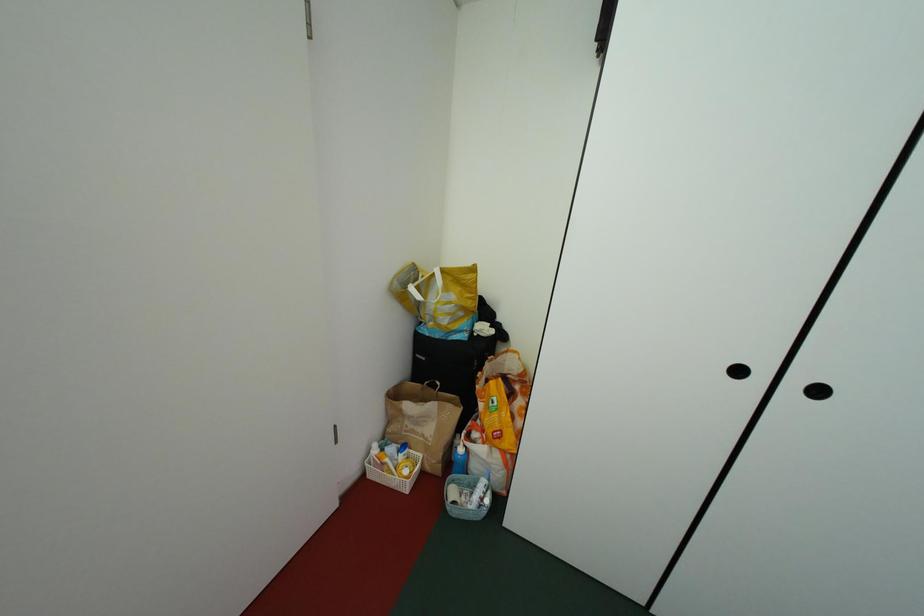
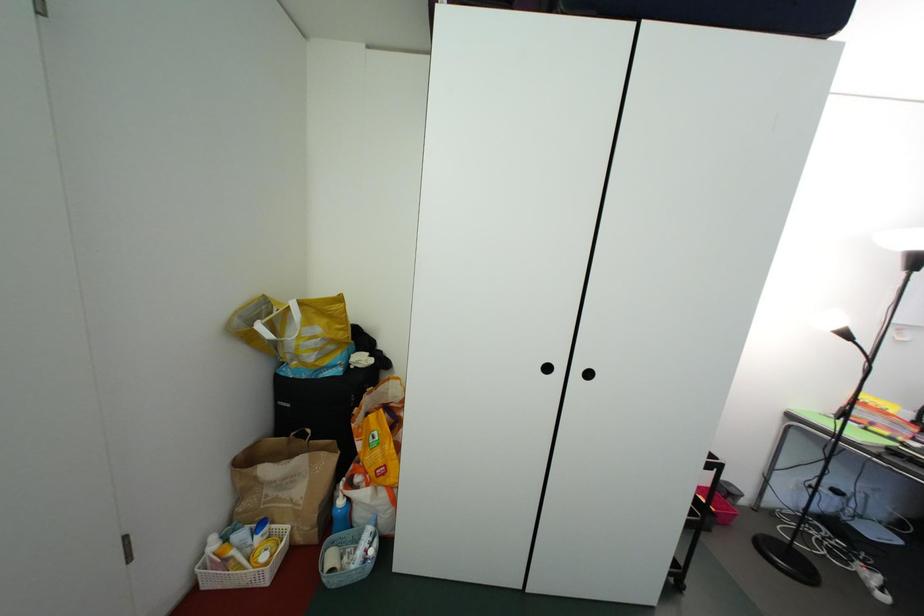
What movement of the cameraman would produce the second image?

The cameraman moved toward right, backward.